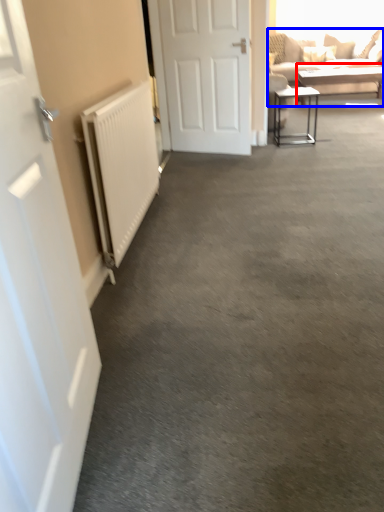
Question: Which of the following is the farthest to the observer, table (highlighted by a red box) or studio couch (highlighted by a blue box)?

Choices:
 (A) table
 (B) studio couch

Answer: (A)